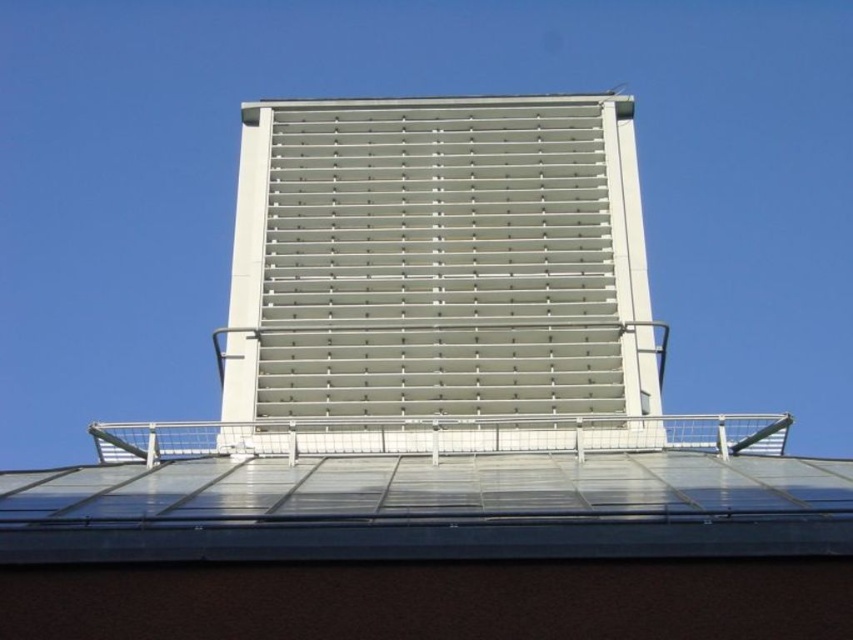
Is white metallic slats at center bigger than transparent glass roof at center?

Indeed, white metallic slats at center has a larger size compared to transparent glass roof at center.

Locate an element on the screen. white metallic slats at center is located at coordinates (439, 275).